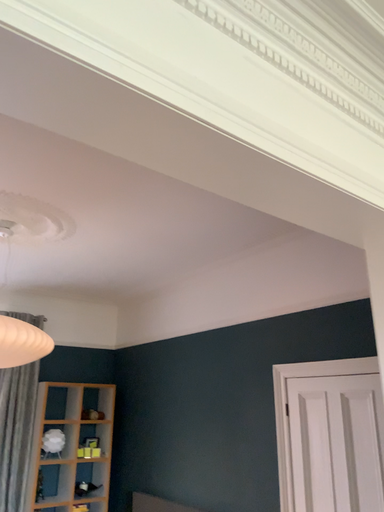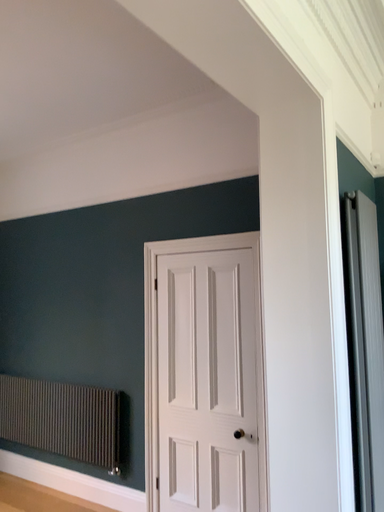
Question: Which way did the camera rotate in the video?

Choices:
 (A) rotated left
 (B) rotated right

Answer: (B)